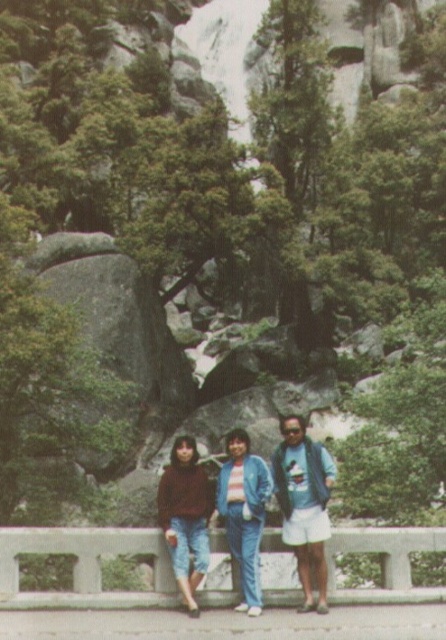
You are a photographer standing on the paved pathway. You want to place a small tripod between the concrete at center and the blue denim pants at center. Based on their positions, where should you place the tripod?

The tripod should be placed below the concrete at center since the concrete is above the blue denim pants at center, meaning the pants are located lower than the concrete. Therefore, positioning the tripod below the concrete would place it between the two objects.